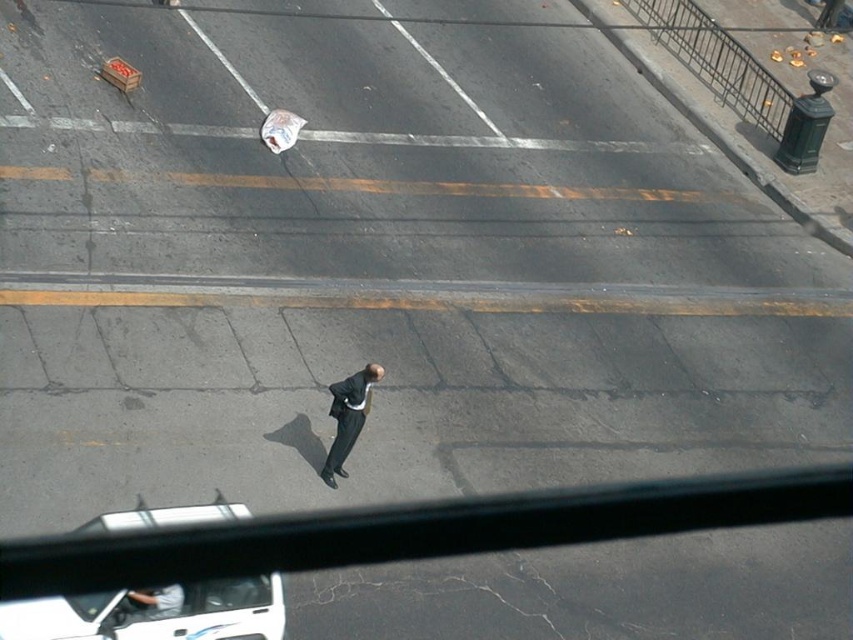
Is white glossy car at lower left taller than dark gray suit at center?

No, white glossy car at lower left is not taller than dark gray suit at center.

Consider the image. Who is more distant from viewer, (215, 584) or (335, 435)?

Point (335, 435)

Which is in front, point (30, 621) or point (347, 376)?

Point (30, 621) is in front.

You are a GUI agent. You are given a task and a screenshot of the screen. Output one action in this format:
    pyautogui.click(x=<x>, y=<y>)
    Task: Click on the white glossy car at lower left
    The width and height of the screenshot is (853, 640).
    Given the screenshot: What is the action you would take?
    pyautogui.click(x=154, y=612)